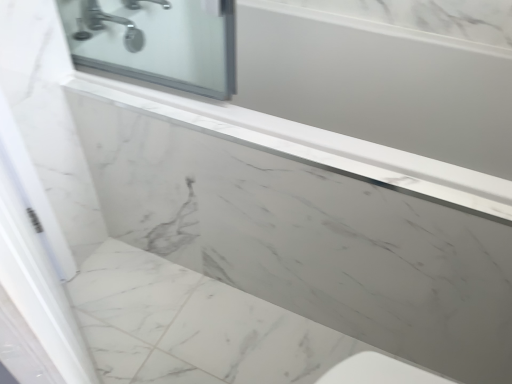
Where is `white marble screen door at left`? This screenshot has width=512, height=384. white marble screen door at left is located at coordinates (37, 257).

Describe the element at coordinates (37, 257) in the screenshot. I see `white marble screen door at left` at that location.

Where is `silver metallic faucet at upper left`? Image resolution: width=512 pixels, height=384 pixels. silver metallic faucet at upper left is located at coordinates (105, 26).

What do you see at coordinates (105, 26) in the screenshot?
I see `silver metallic faucet at upper left` at bounding box center [105, 26].

In order to face silver metallic faucet at upper left, should I rotate leftwards or rightwards?

Rotate left and turn 19.003 degrees.

Find the location of a particular element. The image size is (512, 384). white marble screen door at left is located at coordinates (37, 257).

In the scene shown: Does white marble screen door at left appear on the right side of silver metallic faucet at upper left?

Correct, you'll find white marble screen door at left to the right of silver metallic faucet at upper left.

Which object is further away from the camera, white marble screen door at left or silver metallic faucet at upper left?

silver metallic faucet at upper left is more distant.

Is point (27, 224) in front of point (133, 48)?

Yes, point (27, 224) is closer to viewer.

From the image's perspective, is white marble screen door at left under silver metallic faucet at upper left?

Yes, from the image's perspective, white marble screen door at left is below silver metallic faucet at upper left.

From a real-world perspective, between white marble screen door at left and silver metallic faucet at upper left, who is vertically higher?

silver metallic faucet at upper left is physically above.

Considering the sizes of white marble screen door at left and silver metallic faucet at upper left in the image, is white marble screen door at left wider or thinner than silver metallic faucet at upper left?

Clearly, white marble screen door at left has less width compared to silver metallic faucet at upper left.

Is white marble screen door at left taller or shorter than silver metallic faucet at upper left?

Clearly, white marble screen door at left is taller compared to silver metallic faucet at upper left.

In terms of size, does white marble screen door at left appear bigger or smaller than silver metallic faucet at upper left?

Clearly, white marble screen door at left is larger in size than silver metallic faucet at upper left.

Would you say white marble screen door at left is inside or outside silver metallic faucet at upper left?

white marble screen door at left cannot be found inside silver metallic faucet at upper left.

Is white marble screen door at left not close to silver metallic faucet at upper left?

No, white marble screen door at left is not far away from silver metallic faucet at upper left.

Is white marble screen door at left facing away from silver metallic faucet at upper left?

That's not correct — white marble screen door at left is not looking away from silver metallic faucet at upper left.

Where is `tap positioned vertically above the white marble screen door at left (from a real-world perspective)`? The width and height of the screenshot is (512, 384). tap positioned vertically above the white marble screen door at left (from a real-world perspective) is located at coordinates (105, 26).

Is silver metallic faucet at upper left to the left of white marble screen door at left from the viewer's perspective?

Yes, silver metallic faucet at upper left is to the left of white marble screen door at left.

Relative to white marble screen door at left, is silver metallic faucet at upper left in front or behind?

silver metallic faucet at upper left is positioned farther from the viewer than white marble screen door at left.

Considering the positions of point (102, 21) and point (29, 294), is point (102, 21) closer or farther from the camera than point (29, 294)?

Point (102, 21).

From the image's perspective, which one is positioned higher, silver metallic faucet at upper left or white marble screen door at left?

silver metallic faucet at upper left, from the image's perspective.

From a real-world perspective, is silver metallic faucet at upper left positioned above or below white marble screen door at left?

silver metallic faucet at upper left is situated higher than white marble screen door at left in the real world.

Which object is wider, silver metallic faucet at upper left or white marble screen door at left?

With larger width is silver metallic faucet at upper left.

Based on the photo, is silver metallic faucet at upper left shorter than white marble screen door at left?

Correct, silver metallic faucet at upper left is not as tall as white marble screen door at left.

Considering the sizes of objects silver metallic faucet at upper left and white marble screen door at left in the image provided, who is bigger, silver metallic faucet at upper left or white marble screen door at left?

white marble screen door at left.

Is silver metallic faucet at upper left inside the boundaries of white marble screen door at left, or outside?

silver metallic faucet at upper left is not enclosed by white marble screen door at left.

Are silver metallic faucet at upper left and white marble screen door at left making contact?

No, silver metallic faucet at upper left is not with white marble screen door at left.

Is silver metallic faucet at upper left facing away from white marble screen door at left?

silver metallic faucet at upper left is not turned away from white marble screen door at left.

Measure the distance between silver metallic faucet at upper left and white marble screen door at left.

The distance of silver metallic faucet at upper left from white marble screen door at left is 69.31 centimeters.

Where is `screen door below the silver metallic faucet at upper left (from a real-world perspective)`? The width and height of the screenshot is (512, 384). screen door below the silver metallic faucet at upper left (from a real-world perspective) is located at coordinates (37, 257).

This screenshot has height=384, width=512. What are the coordinates of `tap above the white marble screen door at left (from a real-world perspective)` in the screenshot? It's located at 105,26.

In order to click on tap behind the white marble screen door at left in this screenshot , I will do `click(105, 26)`.